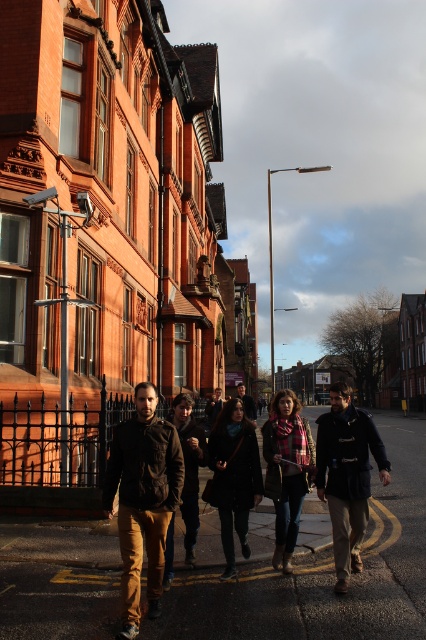
Between plaid fabric scarf at center and dark brown leather jacket at center, which one has less height?

dark brown leather jacket at center is shorter.

Who is lower down, plaid fabric scarf at center or dark brown leather jacket at center?

Positioned lower is dark brown leather jacket at center.

Does point (282, 483) lie behind point (210, 419)?

That is False.

This screenshot has width=426, height=640. What are the coordinates of `plaid fabric scarf at center` in the screenshot? It's located at (287, 470).

Who is shorter, brown suede jacket at center or plaid wool scarf at center?

brown suede jacket at center

Can you confirm if brown suede jacket at center is positioned to the left of plaid wool scarf at center?

Correct, you'll find brown suede jacket at center to the left of plaid wool scarf at center.

Describe the element at coordinates (143, 500) in the screenshot. This screenshot has height=640, width=426. I see `brown suede jacket at center` at that location.

Image resolution: width=426 pixels, height=640 pixels. Find the location of `brown suede jacket at center`. brown suede jacket at center is located at coordinates pyautogui.click(x=143, y=500).

Which of these two, dark blue leather jacket at center or black wool coat at center, stands taller?

With more height is dark blue leather jacket at center.

Between dark blue leather jacket at center and black wool coat at center, which one appears on the left side from the viewer's perspective?

From the viewer's perspective, black wool coat at center appears more on the left side.

Where is `dark blue leather jacket at center`? The height and width of the screenshot is (640, 426). dark blue leather jacket at center is located at coordinates (347, 476).